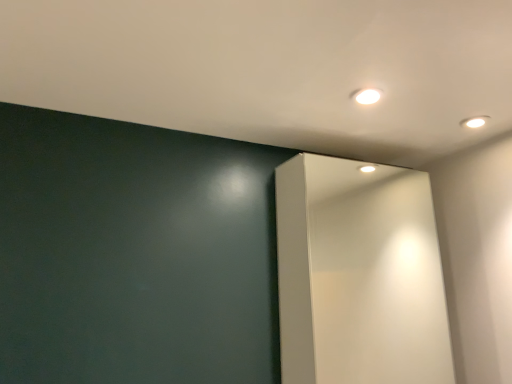
What do you see at coordinates (359, 275) in the screenshot?
I see `white glossy door at center` at bounding box center [359, 275].

The height and width of the screenshot is (384, 512). What are the coordinates of `white glossy door at center` in the screenshot? It's located at (359, 275).

Find the location of a particular element. The width and height of the screenshot is (512, 384). white glossy door at center is located at coordinates (359, 275).